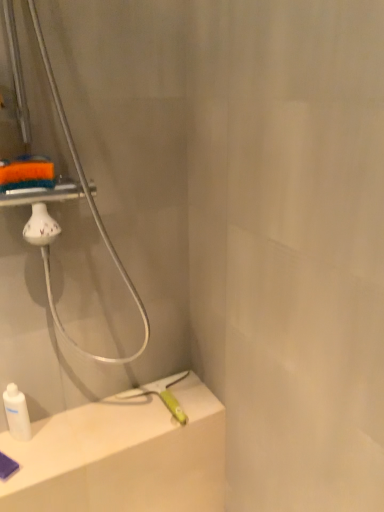
Question: From the image's perspective, is white matte counter top at lower left below white glossy bottle at lower left?

Choices:
 (A) no
 (B) yes

Answer: (B)

Question: Is white matte counter top at lower left outside white glossy bottle at lower left?

Choices:
 (A) no
 (B) yes

Answer: (B)

Question: Can you confirm if white matte counter top at lower left is wider than white glossy bottle at lower left?

Choices:
 (A) yes
 (B) no

Answer: (A)

Question: Is white matte counter top at lower left thinner than white glossy bottle at lower left?

Choices:
 (A) no
 (B) yes

Answer: (A)

Question: From the image's perspective, is white matte counter top at lower left over white glossy bottle at lower left?

Choices:
 (A) yes
 (B) no

Answer: (B)

Question: Considering the relative sizes of white matte counter top at lower left and white glossy bottle at lower left in the image provided, is white matte counter top at lower left taller than white glossy bottle at lower left?

Choices:
 (A) yes
 (B) no

Answer: (B)

Question: Could you tell me if white glossy bottle at lower left is facing white matte counter top at lower left?

Choices:
 (A) yes
 (B) no

Answer: (B)

Question: Is white glossy bottle at lower left closer to the viewer compared to white matte counter top at lower left?

Choices:
 (A) yes
 (B) no

Answer: (B)

Question: Does white glossy bottle at lower left touch white matte counter top at lower left?

Choices:
 (A) no
 (B) yes

Answer: (A)

Question: Are white glossy bottle at lower left and white matte counter top at lower left far apart?

Choices:
 (A) yes
 (B) no

Answer: (B)

Question: Would you say white matte counter top at lower left is part of white glossy bottle at lower left's contents?

Choices:
 (A) yes
 (B) no

Answer: (B)

Question: From the image's perspective, is white glossy bottle at lower left located beneath white matte counter top at lower left?

Choices:
 (A) yes
 (B) no

Answer: (B)

Question: From the image's perspective, relative to white matte counter top at lower left, is white glossy bottle at lower left above or below?

Choices:
 (A) below
 (B) above

Answer: (B)